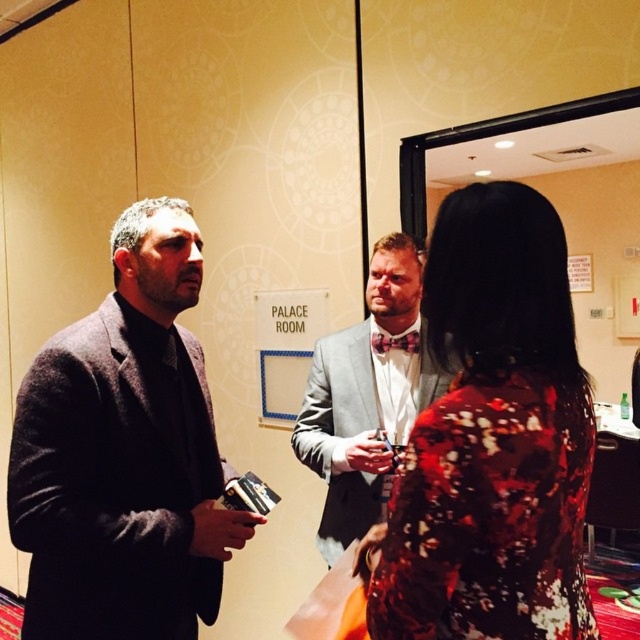
You are organizing a fashion show and need to ensure that the silver metallic suit at center and the shiny red bow tie at center can be displayed together on a mannequin. Given that the mannequin has a maximum width capacity of 1.2 meters, can both items be displayed together without exceeding the width limit?

The silver metallic suit at center has a width larger than the shiny red bow tie at center. Since the mannequin can only hold up to 1.2 meters, we need to know the exact width of the suit to determine if it fits. However, the description only states that the suit is wider than the bow tie, not the exact measurement. Therefore, it is uncertain if both can fit together without exceeding the limit.

Looking at this image, you are organizing a photo shoot and need to arrange the dark wool suit at left and the silver metallic suit at center in a row for a magazine spread. Based on their widths, which should be placed on the left side to ensure proper alignment?

The dark wool suit at left should be placed on the left side since it might be wider than the silver metallic suit at center, allowing for better visual balance in the magazine spread.

You are an event planner arranging seating for a dinner. You need to place a name tag for the person in the floral dress at center and the person in the silver metallic suit at center. Based on their positions in the image, which name tag should be placed higher on the table?

The floral dress at center is above the silver metallic suit at center in the image, so the name tag for the person in the floral dress at center should be placed higher on the table.